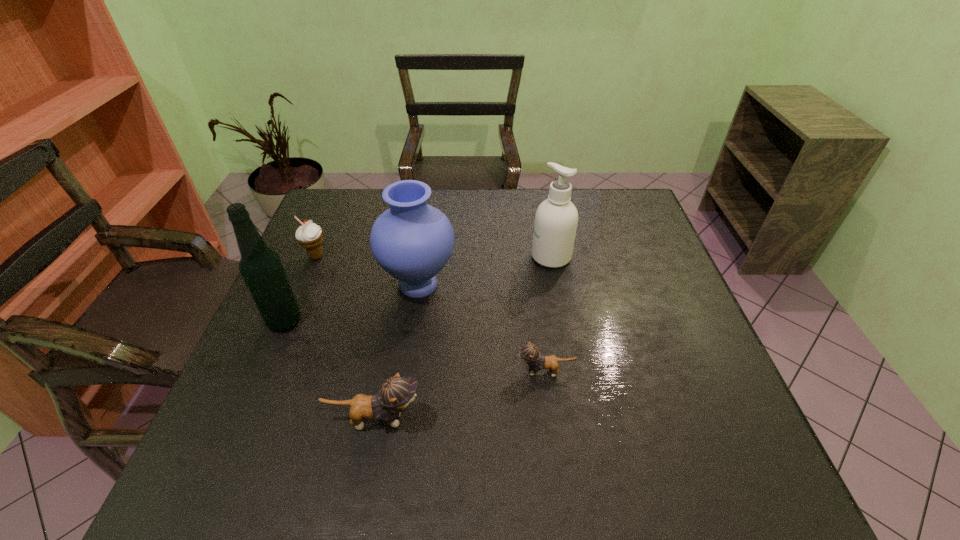
The image size is (960, 540). I want to click on the nearest object, so click(x=396, y=393).

You are a GUI agent. You are given a task and a screenshot of the screen. Output one action in this format:
    pyautogui.click(x=<x>, y=<y>)
    Task: Click on the left kitten
    Image resolution: width=960 pixels, height=540 pixels.
    Given the screenshot: What is the action you would take?
    pyautogui.click(x=396, y=393)

Locate an element on the screen. the farther kitten is located at coordinates tap(529, 353).

Find the location of a particular element. This screenshot has height=540, width=960. the shorter kitten is located at coordinates (529, 353).

Where is `cleansing agent`? Image resolution: width=960 pixels, height=540 pixels. cleansing agent is located at coordinates (556, 219).

You are a GUI agent. You are given a task and a screenshot of the screen. Output one action in this format:
    pyautogui.click(x=<x>, y=<y>)
    Task: Click on the vase
    The height and width of the screenshot is (540, 960).
    Given the screenshot: What is the action you would take?
    pyautogui.click(x=412, y=241)

In order to click on alcohol in this screenshot , I will do `click(261, 268)`.

Locate an element on the screen. icecream is located at coordinates (309, 235).

This screenshot has width=960, height=540. Identify the location of free space located on the front-facing side of the left kitten. (576, 420).

Locate an element on the screen. free location located 0.310m on the front-facing side of the shorter kitten is located at coordinates (375, 372).